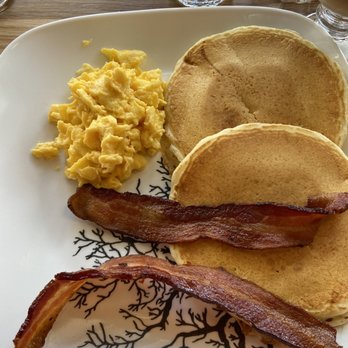
Where is `table top`? The height and width of the screenshot is (348, 348). table top is located at coordinates (24, 6).